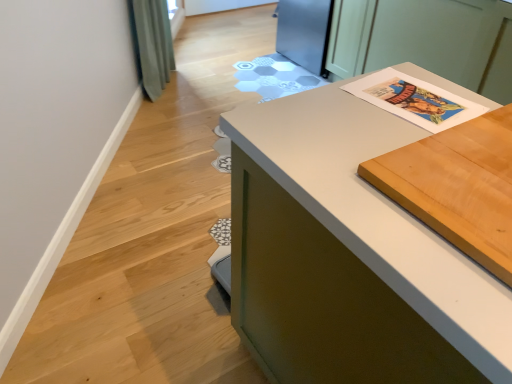
Question: From the image's perspective, is light brown wood cutting board at upper right on top of white matte countertop at center?

Choices:
 (A) yes
 (B) no

Answer: (A)

Question: Is light brown wood cutting board at upper right positioned with its back to white matte countertop at center?

Choices:
 (A) yes
 (B) no

Answer: (A)

Question: Does light brown wood cutting board at upper right lie behind white matte countertop at center?

Choices:
 (A) yes
 (B) no

Answer: (B)

Question: Is light brown wood cutting board at upper right outside of white matte countertop at center?

Choices:
 (A) no
 (B) yes

Answer: (A)

Question: Is light brown wood cutting board at upper right taller than white matte countertop at center?

Choices:
 (A) yes
 (B) no

Answer: (B)

Question: From their relative heights in the image, would you say white matte countertop at center is taller or shorter than white paper at upper right?

Choices:
 (A) tall
 (B) short

Answer: (A)

Question: Is white matte countertop at center in front of or behind white paper at upper right in the image?

Choices:
 (A) front
 (B) behind

Answer: (A)

Question: From the image's perspective, is white matte countertop at center above or below white paper at upper right?

Choices:
 (A) above
 (B) below

Answer: (B)

Question: Considering the positions of white matte countertop at center and white paper at upper right in the image, is white matte countertop at center wider or thinner than white paper at upper right?

Choices:
 (A) wide
 (B) thin

Answer: (A)

Question: From a real-world perspective, is white matte countertop at center above or below light brown wood cutting board at upper right?

Choices:
 (A) above
 (B) below

Answer: (B)

Question: Is white matte countertop at center taller or shorter than light brown wood cutting board at upper right?

Choices:
 (A) tall
 (B) short

Answer: (A)

Question: Considering their positions, is white matte countertop at center located in front of or behind light brown wood cutting board at upper right?

Choices:
 (A) behind
 (B) front

Answer: (A)

Question: Which is correct: white matte countertop at center is inside light brown wood cutting board at upper right, or outside of it?

Choices:
 (A) inside
 (B) outside

Answer: (B)

Question: Is white paper at upper right spatially inside white matte countertop at center, or outside of it?

Choices:
 (A) outside
 (B) inside

Answer: (A)

Question: In the image, is white paper at upper right positioned in front of or behind white matte countertop at center?

Choices:
 (A) front
 (B) behind

Answer: (B)